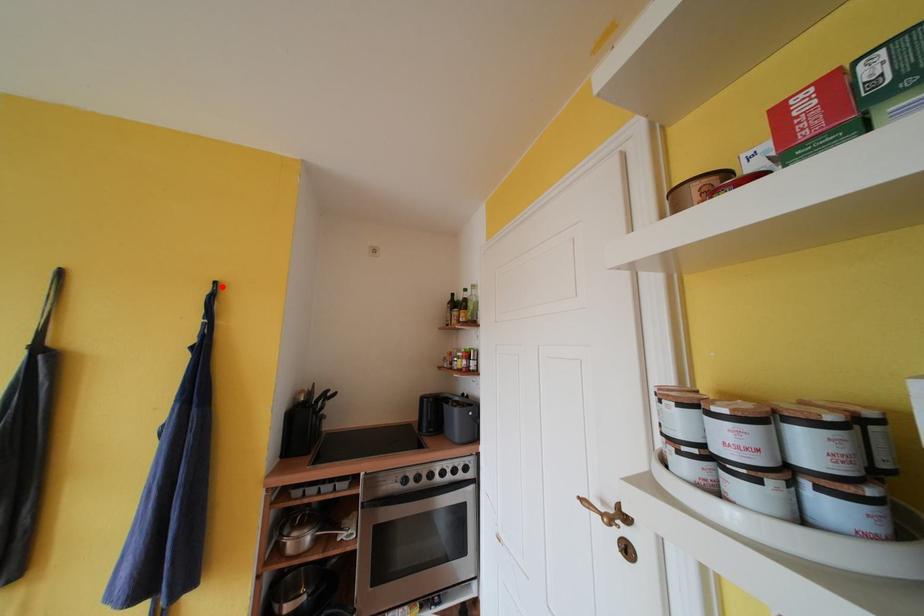
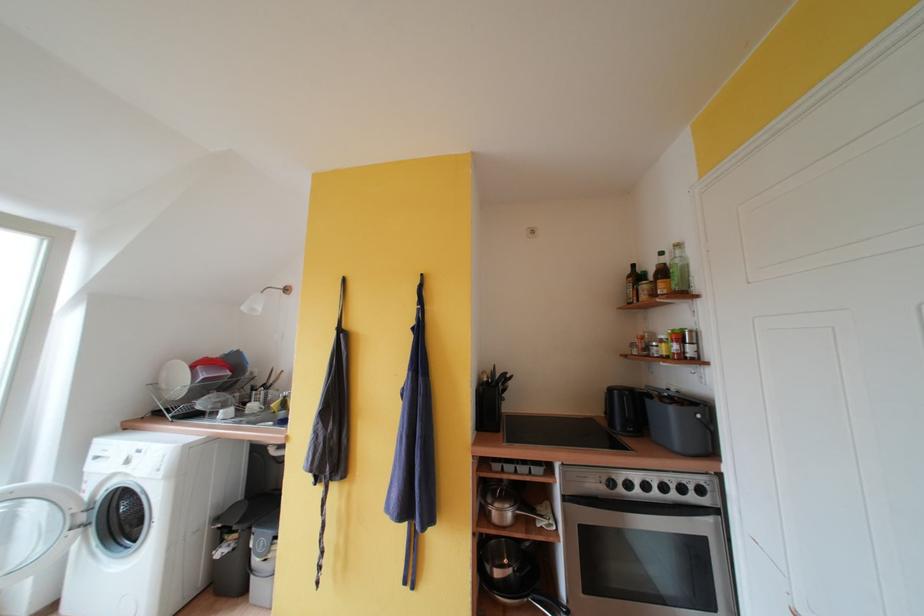
Where in the second image is the point corresponding to the highlighted location from the first image?

(428, 278)